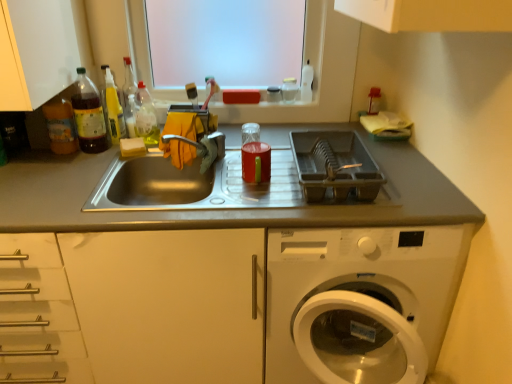
Where is `free location in front of translucent plastic bottle at left, which is the third bottle from right to left`? free location in front of translucent plastic bottle at left, which is the third bottle from right to left is located at coordinates (74, 163).